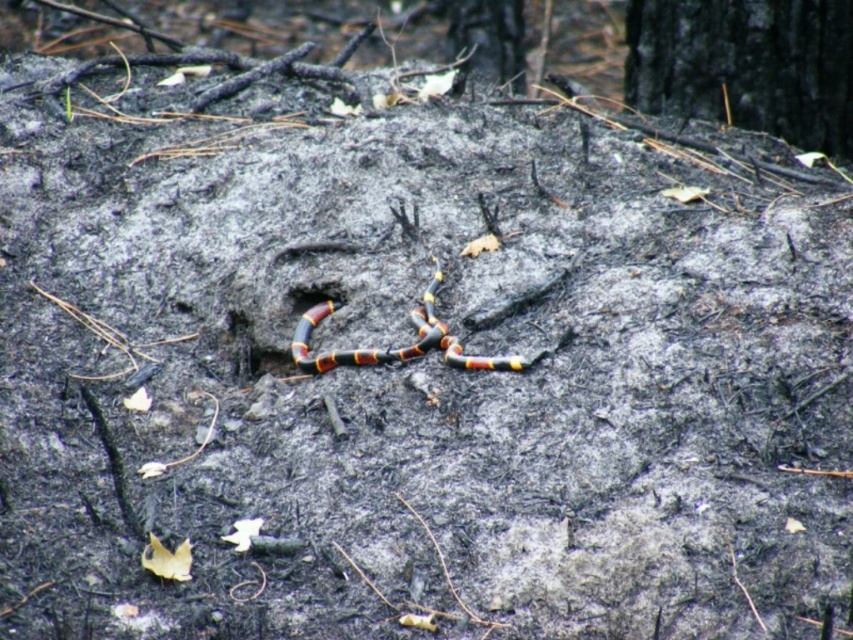
Question: Does black charred tree trunk at upper right appear on the left side of smooth dark brown tree trunk at upper center?

Choices:
 (A) no
 (B) yes

Answer: (A)

Question: Which point appears farthest from the camera in this image?

Choices:
 (A) (415, 326)
 (B) (720, 1)

Answer: (B)

Question: Can you confirm if smooth dark brown tree trunk at upper center is bigger than smooth clay hole at center?

Choices:
 (A) no
 (B) yes

Answer: (B)

Question: Which object is farther from the camera taking this photo?

Choices:
 (A) smooth dark brown tree trunk at upper center
 (B) black charred tree trunk at upper right
 (C) black and orange striped snake at center

Answer: (A)

Question: Is black charred tree trunk at upper right smaller than smooth clay hole at center?

Choices:
 (A) yes
 (B) no

Answer: (B)

Question: Which of the following is the farthest from the observer?

Choices:
 (A) (492, 28)
 (B) (316, 289)

Answer: (A)